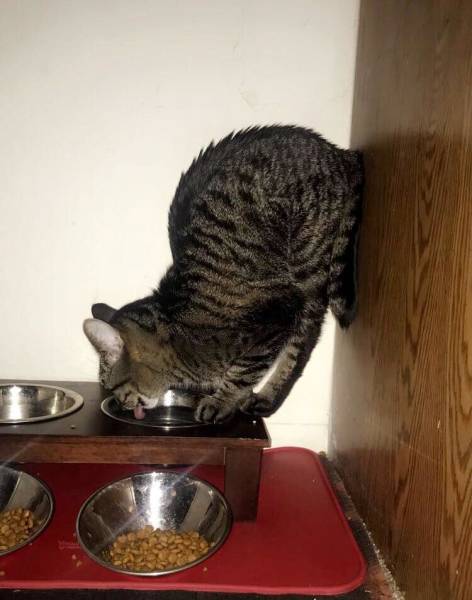
The width and height of the screenshot is (472, 600). In order to click on water bowl in this screenshot , I will do `click(168, 416)`, `click(22, 406)`.